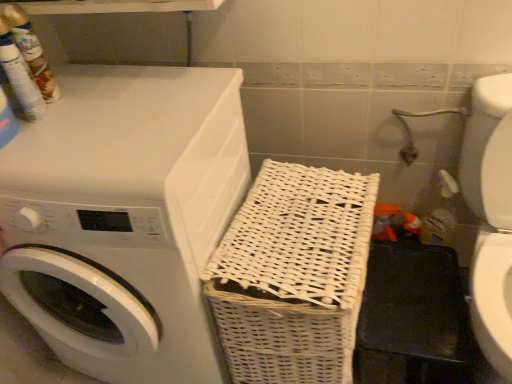
Question: Does white matte/woven laundry basket at right have a lesser height compared to white glossy washer at lower right?

Choices:
 (A) no
 (B) yes

Answer: (A)

Question: Is white glossy washer at lower right inside white matte/woven laundry basket at right?

Choices:
 (A) yes
 (B) no

Answer: (B)

Question: Is white matte/woven laundry basket at right thinner than white glossy washer at lower right?

Choices:
 (A) yes
 (B) no

Answer: (A)

Question: From the image's perspective, would you say white matte/woven laundry basket at right is positioned over white glossy washer at lower right?

Choices:
 (A) yes
 (B) no

Answer: (A)

Question: Is white matte/woven laundry basket at right directly adjacent to white glossy washer at lower right?

Choices:
 (A) no
 (B) yes

Answer: (A)

Question: Is white matte/woven laundry basket at right facing away from white glossy washer at lower right?

Choices:
 (A) yes
 (B) no

Answer: (B)

Question: Does white wicker basket at center have a lesser width compared to white glossy washer at lower right?

Choices:
 (A) no
 (B) yes

Answer: (B)

Question: Could white glossy washer at lower right be considered to be inside white wicker basket at center?

Choices:
 (A) no
 (B) yes

Answer: (A)

Question: Can we say white wicker basket at center lies outside white glossy washer at lower right?

Choices:
 (A) no
 (B) yes

Answer: (B)

Question: Considering the relative positions of white wicker basket at center and white glossy washer at lower right in the image provided, is white wicker basket at center to the right of white glossy washer at lower right from the viewer's perspective?

Choices:
 (A) yes
 (B) no

Answer: (B)

Question: From the image's perspective, is white wicker basket at center located above white glossy washer at lower right?

Choices:
 (A) no
 (B) yes

Answer: (A)

Question: From the image's perspective, is white wicker basket at center below white glossy washer at lower right?

Choices:
 (A) no
 (B) yes

Answer: (B)

Question: Can white wicker basket at center be found inside white glossy washer at lower right?

Choices:
 (A) yes
 (B) no

Answer: (B)